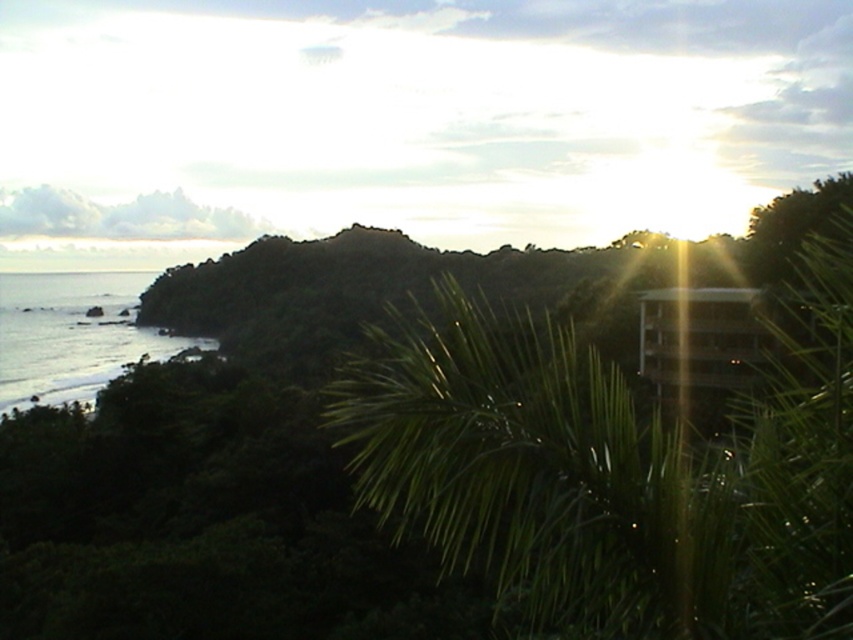
Does green leafy palm tree at center appear on the left side of clear water at lower left?

Incorrect, green leafy palm tree at center is not on the left side of clear water at lower left.

Measure the distance between point (556, 506) and camera.

A distance of 9.86 feet exists between point (556, 506) and camera.

Between point (790, 486) and point (102, 342), which one is positioned behind?

Point (102, 342)

Locate an element on the screen. This screenshot has height=640, width=853. green leafy palm tree at center is located at coordinates (618, 472).